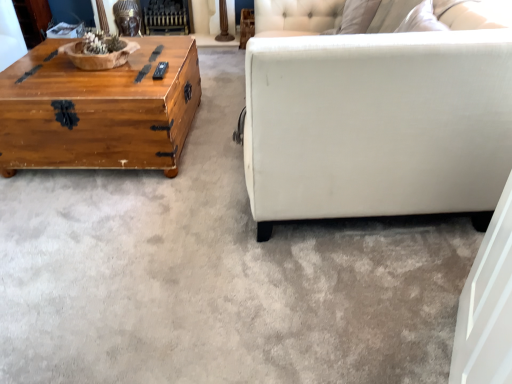
Question: From the image's perspective, is black metal fireplace at upper center positioned above or below wooden chest at left?

Choices:
 (A) below
 (B) above

Answer: (B)

Question: Considering their positions, is black metal fireplace at upper center located in front of or behind wooden chest at left?

Choices:
 (A) behind
 (B) front

Answer: (A)

Question: From their relative heights in the image, would you say black metal fireplace at upper center is taller or shorter than wooden chest at left?

Choices:
 (A) tall
 (B) short

Answer: (B)

Question: In terms of height, does wooden chest at left look taller or shorter compared to black metal fireplace at upper center?

Choices:
 (A) short
 (B) tall

Answer: (B)

Question: In the image, is wooden chest at left positioned in front of or behind black metal fireplace at upper center?

Choices:
 (A) behind
 (B) front

Answer: (B)

Question: Which is correct: wooden chest at left is inside black metal fireplace at upper center, or outside of it?

Choices:
 (A) inside
 (B) outside

Answer: (B)

Question: In terms of size, does wooden chest at left appear bigger or smaller than black metal fireplace at upper center?

Choices:
 (A) small
 (B) big

Answer: (B)